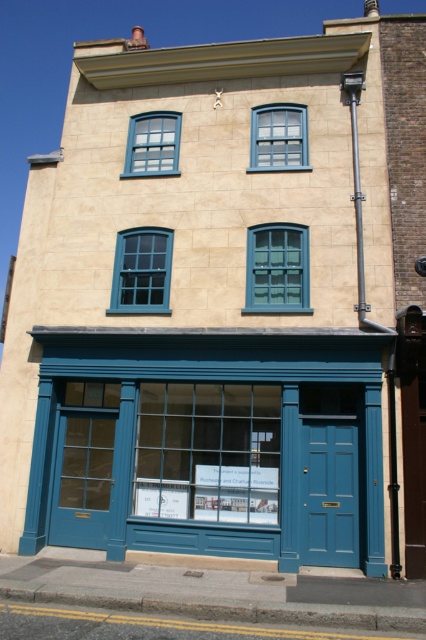
Question: Where is matte blue storefront at center located in relation to matte blue window at upper center in the image?

Choices:
 (A) left
 (B) right

Answer: (A)

Question: Which is nearer to the clear glass window at center?

Choices:
 (A) matte blue window at upper center
 (B) teal wooden window at center
 (C) matte teal glass window at center
 (D) matte blue storefront at center

Answer: (B)

Question: Can you confirm if teal wooden window at center is positioned below matte blue window at upper center?

Choices:
 (A) yes
 (B) no

Answer: (A)

Question: Can you confirm if clear glass window at center is smaller than matte teal glass window at center?

Choices:
 (A) no
 (B) yes

Answer: (A)

Question: Among these points, which one is nearest to the camera?

Choices:
 (A) (40, 509)
 (B) (157, 304)
 (C) (302, 266)
 (D) (146, 129)

Answer: (A)

Question: Which object is closer to the camera taking this photo?

Choices:
 (A) blue glass window at upper center
 (B) teal wooden window at center
 (C) matte teal glass window at center

Answer: (B)